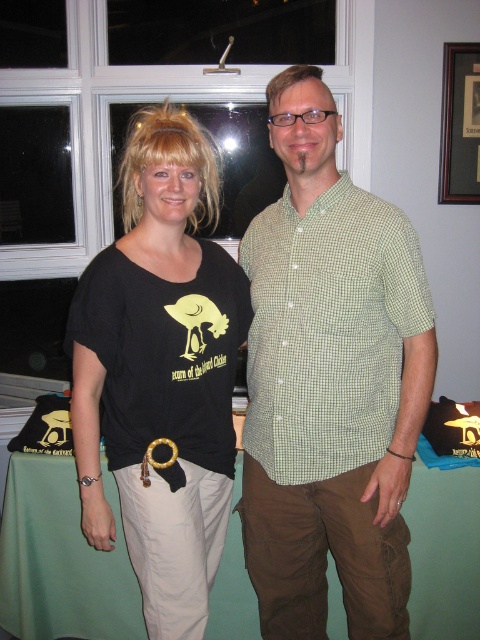
You are standing in the room and want to place a small vase on the table. The table is covered by the green fabric tablecloth at lower center. Where should you position the vase so it doesn not block the green checkered shirt at center?

Place the vase to the left side of the green fabric tablecloth at lower center, as the green checkered shirt at center is positioned to the right of the tablecloth. This way, the vase won not obstruct the view of the shirt.